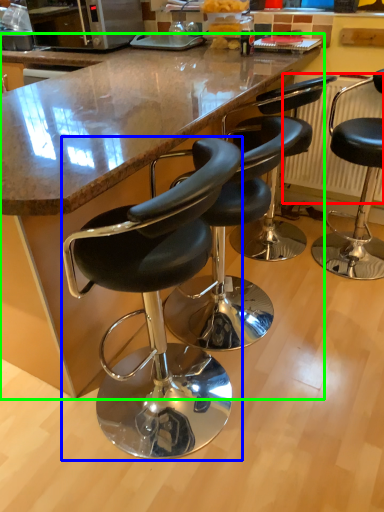
Question: Which object is the farthest from radiator (highlighted by a red box)? Choose among these: chair (highlighted by a blue box) or counter (highlighted by a green box).

Choices:
 (A) chair
 (B) counter

Answer: (A)